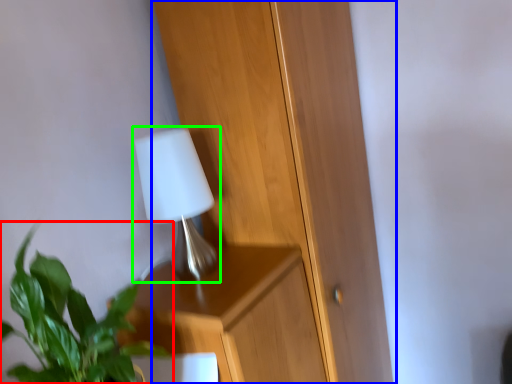
Question: Based on their relative distances, which object is farther from houseplant (highlighted by a red box)? Choose from dresser (highlighted by a blue box) and lamp (highlighted by a green box).

Choices:
 (A) dresser
 (B) lamp

Answer: (A)